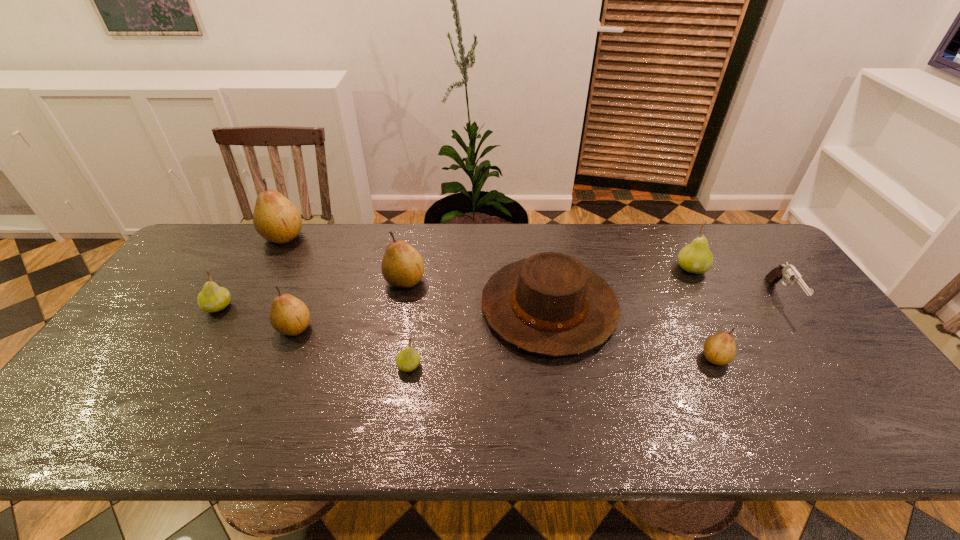
I want to click on free location at the right edge of the desktop, so click(x=780, y=284).

I want to click on vacant space at the near left corner, so click(x=121, y=420).

You are a GUI agent. You are given a task and a screenshot of the screen. Output one action in this format:
    pyautogui.click(x=<x>, y=<y>)
    Task: Click on the free space between the biggest green pear and the second biggest green pear
    This screenshot has height=540, width=960.
    Given the screenshot: What is the action you would take?
    click(x=455, y=288)

You are a GUI agent. You are given a task and a screenshot of the screen. Output one action in this format:
    pyautogui.click(x=<x>, y=<y>)
    Task: Click on the empty space that is in between the farthest green pear and the gun
    
    Given the screenshot: What is the action you would take?
    pyautogui.click(x=736, y=282)

Find the location of a particular element. unoccupied area between the cowboy hat and the rightmost object is located at coordinates (665, 302).

The height and width of the screenshot is (540, 960). In order to click on object that is the second closest to the cowboy hat in this screenshot , I will do `click(402, 266)`.

The height and width of the screenshot is (540, 960). What are the coordinates of `object that is the fourth closest to the third brown pear from left to right` in the screenshot? It's located at (275, 218).

This screenshot has height=540, width=960. Identify the location of pear that stands as the fifth closest to the second biggest brown pear. click(x=720, y=349).

I want to click on pear object that ranks as the seventh closest to the fourth object from right to left, so click(212, 298).

Identify the location of brown pear that is the closest to the third object from left to right. The width and height of the screenshot is (960, 540). (402, 266).